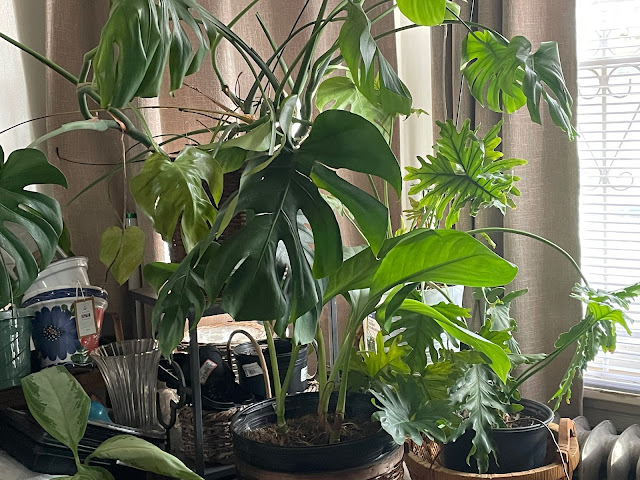
Image resolution: width=640 pixels, height=480 pixels. I want to click on pots with plants, so click(x=512, y=443), click(x=336, y=454), click(x=17, y=345).